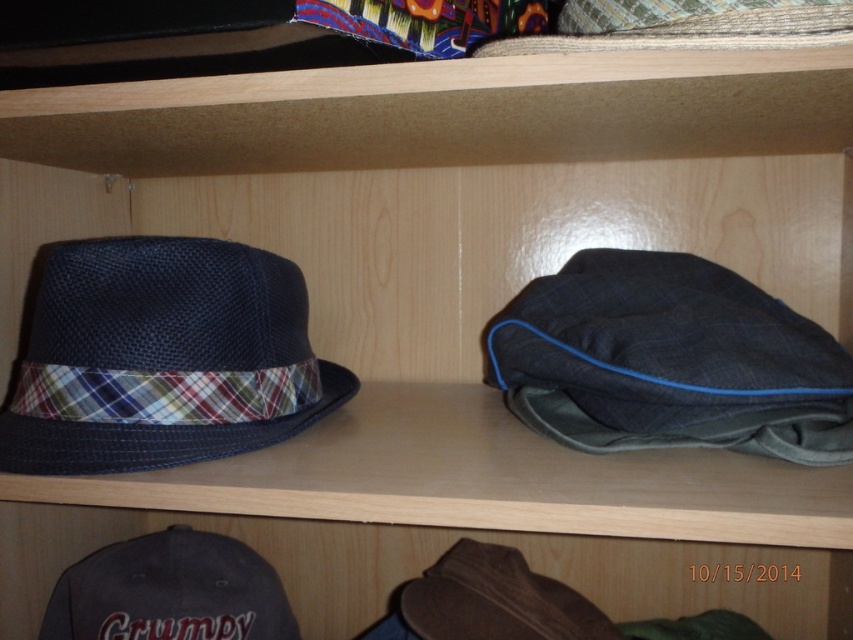
Is dark blue woven hat at left further to camera compared to dark gray fabric cap at lower left?

No, dark blue woven hat at left is in front of dark gray fabric cap at lower left.

Is point (141, 349) positioned in front of point (244, 561)?

That is True.

Who is more forward, (172, 301) or (242, 605)?

Point (172, 301) is in front.

You are a GUI agent. You are given a task and a screenshot of the screen. Output one action in this format:
    pyautogui.click(x=<x>, y=<y>)
    Task: Click on the dark blue woven hat at left
    The height and width of the screenshot is (640, 853).
    Given the screenshot: What is the action you would take?
    pyautogui.click(x=161, y=356)

Can you confirm if dark blue woven hat at left is positioned to the right of brown leather cowboy hat at lower center?

In fact, dark blue woven hat at left is to the left of brown leather cowboy hat at lower center.

Does dark blue woven hat at left appear under brown leather cowboy hat at lower center?

No.

Between point (109, 440) and point (514, 632), which one is positioned behind?

Positioned behind is point (514, 632).

This screenshot has width=853, height=640. I want to click on dark blue woven hat at left, so click(x=161, y=356).

Which is behind, point (93, 636) or point (442, 582)?

Positioned behind is point (442, 582).

Is the position of dark gray fabric cap at lower left less distant than that of brown leather cowboy hat at lower center?

That is False.

Locate an element on the screen. This screenshot has width=853, height=640. dark gray fabric cap at lower left is located at coordinates (170, 592).

Locate an element on the screen. Image resolution: width=853 pixels, height=640 pixels. dark gray fabric cap at lower left is located at coordinates (170, 592).